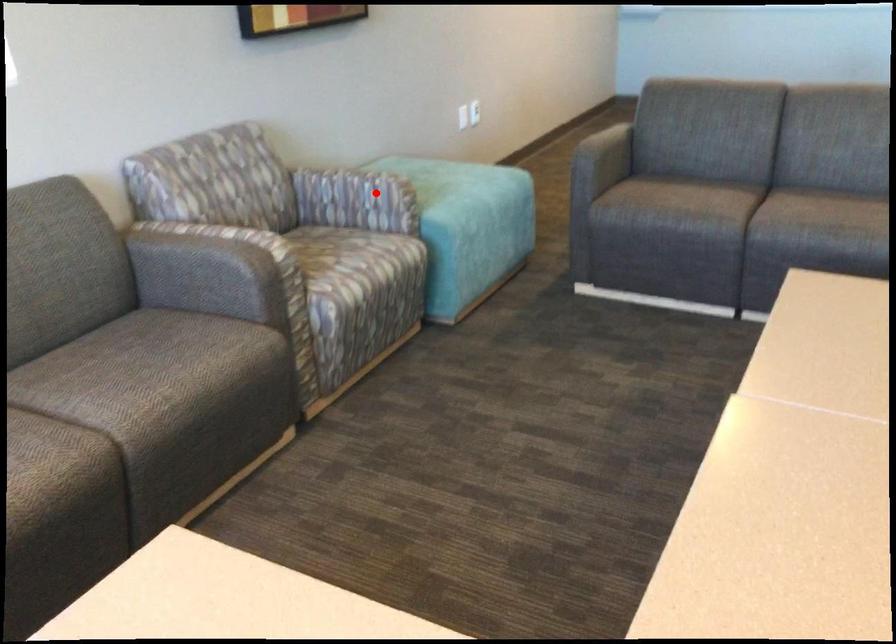
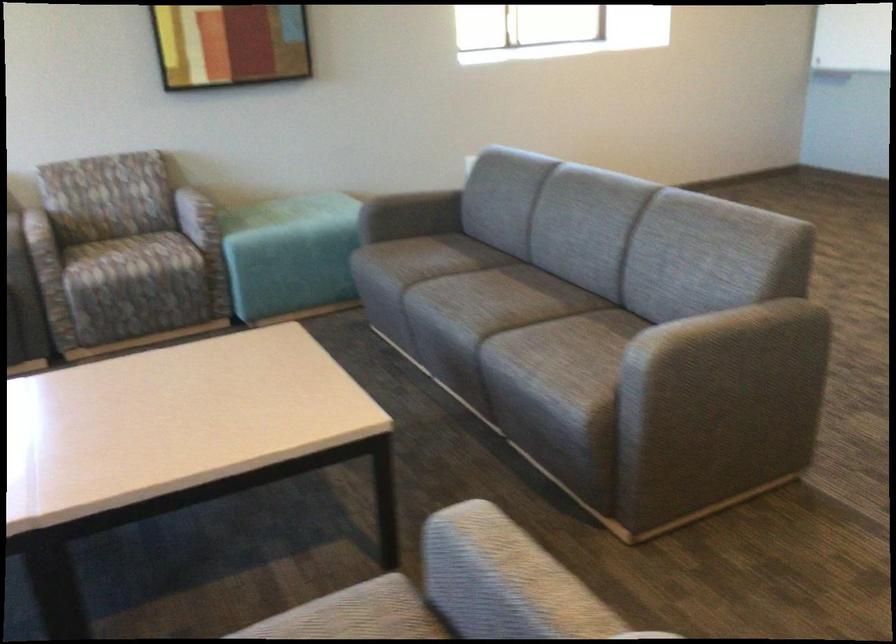
Question: A red point is marked in image1. In image2, is the corresponding 3D point closer to the camera or farther? Reply with the corresponding letter.

Choices:
 (A) The corresponding 3D point is closer.
 (B) The corresponding 3D point is farther.

Answer: (B)